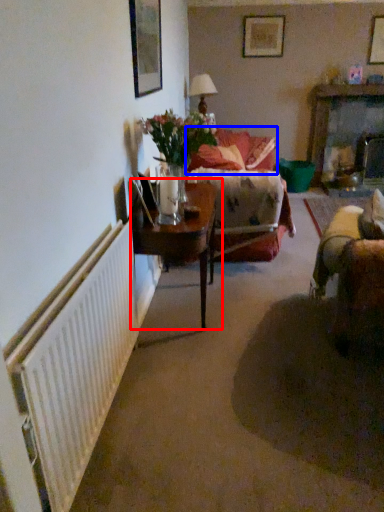
Question: Which object is closer to the camera taking this photo, table (highlighted by a red box) or couch (highlighted by a blue box)?

Choices:
 (A) table
 (B) couch

Answer: (A)